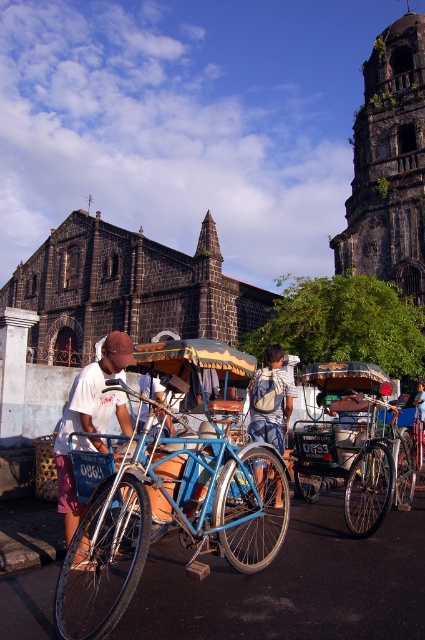
You need to carry both the brushed metal bicycle at left and the light brown wooden stick at center through a narrow doorway that is 1.2 meters wide. Which one should you carry first to ensure both can fit through?

You should carry the light brown wooden stick at center first since the brushed metal bicycle at left is wider. After carrying the wider bicycle, there might not be enough space left for the stick, but if you start with the narrower stick, both can fit as the total width required would be the sum of both, but since the bicycle is wider than the stick, carrying the narrower one first allows the wider to pass through as it is still within the 1.2 meters width if each individually fits. However, if their total

You are standing at the center of the street in front of the dark stone tower at upper right. If you turn 90 degrees to your left, which direction will you be facing?

Since the dark stone tower at upper right is located at coordinates point (388, 164), turning 90 degrees to your left from the center of the street would orient you facing north. However, without specific coordinate directions, the exact direction cannot be determined. The question might be better framed using relative positions rather than coordinates.

You are a photographer planning to take a photo of the dark stone tower at upper right and the metallic blue rickshaw at center. Since you want both subjects to be clearly visible in the frame, which one should you focus on first to ensure proper focus?

The dark stone tower at upper right should be focused on first because it is taller than the metallic blue rickshaw at center, ensuring that its details are sharp before adjusting focus for the smaller subject.